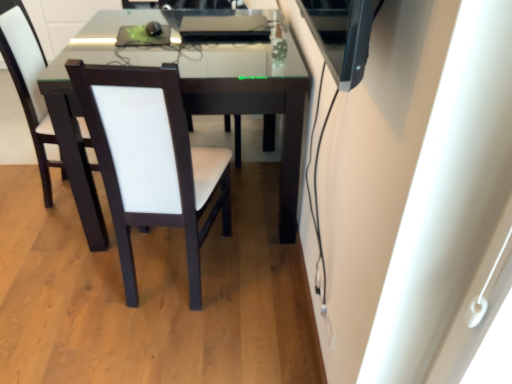
Question: Which direction should I rotate to look at white leather chair at center, the third chair in the right-to-left sequence?

Choices:
 (A) right
 (B) left

Answer: (B)

Question: Can you confirm if white leather chair at center, the third chair in the right-to-left sequence, is shorter than white leather chair at center, which is counted as the 3th chair, starting from the left?

Choices:
 (A) no
 (B) yes

Answer: (A)

Question: Is there a large distance between white leather chair at center, which appears as the 1th chair when viewed from the left, and white leather chair at center, which is counted as the 3th chair, starting from the left?

Choices:
 (A) no
 (B) yes

Answer: (A)

Question: Is white leather chair at center, which appears as the 1th chair when viewed from the left, turned away from white leather chair at center, the 1th chair from the right?

Choices:
 (A) yes
 (B) no

Answer: (A)

Question: Is white leather chair at center, the third chair in the right-to-left sequence, further to the viewer compared to white leather chair at center, the 1th chair from the right?

Choices:
 (A) yes
 (B) no

Answer: (A)

Question: Could you tell me if white leather chair at center, the third chair in the right-to-left sequence, is turned towards white leather chair at center, which is counted as the 3th chair, starting from the left?

Choices:
 (A) yes
 (B) no

Answer: (A)

Question: Considering the relative positions of white leather chair at center, which appears as the 1th chair when viewed from the left, and white leather chair at center, the 1th chair from the right, in the image provided, is white leather chair at center, which appears as the 1th chair when viewed from the left, to the left of white leather chair at center, the 1th chair from the right, from the viewer's perspective?

Choices:
 (A) yes
 (B) no

Answer: (A)

Question: Does white leather chair at center, the 2th chair in the left-to-right sequence, have a lesser width compared to white leather chair at center, the third chair in the right-to-left sequence?

Choices:
 (A) yes
 (B) no

Answer: (B)

Question: Does white leather chair at center, the 2th chair in the left-to-right sequence, turn towards white leather chair at center, which appears as the 1th chair when viewed from the left?

Choices:
 (A) yes
 (B) no

Answer: (B)

Question: From the image's perspective, is white leather chair at center, the 2th chair in the left-to-right sequence, over white leather chair at center, which appears as the 1th chair when viewed from the left?

Choices:
 (A) no
 (B) yes

Answer: (A)

Question: Considering the relative positions of white leather chair at center, the 2th chair in the left-to-right sequence, and white leather chair at center, which appears as the 1th chair when viewed from the left, in the image provided, is white leather chair at center, the 2th chair in the left-to-right sequence, to the left of white leather chair at center, which appears as the 1th chair when viewed from the left, from the viewer's perspective?

Choices:
 (A) no
 (B) yes

Answer: (A)

Question: Is white leather chair at center, the third chair in the right-to-left sequence, inside white leather chair at center, the 2th chair in the left-to-right sequence?

Choices:
 (A) no
 (B) yes

Answer: (A)

Question: From a real-world perspective, is white leather chair at center, the 2th chair in the left-to-right sequence, located higher than white leather chair at center, which appears as the 1th chair when viewed from the left?

Choices:
 (A) yes
 (B) no

Answer: (B)

Question: Considering the relative sizes of white leather chair at center, which is counted as the 3th chair, starting from the left, and white leather chair at center, the 2th chair in the left-to-right sequence, in the image provided, is white leather chair at center, which is counted as the 3th chair, starting from the left, bigger than white leather chair at center, the 2th chair in the left-to-right sequence,?

Choices:
 (A) yes
 (B) no

Answer: (A)